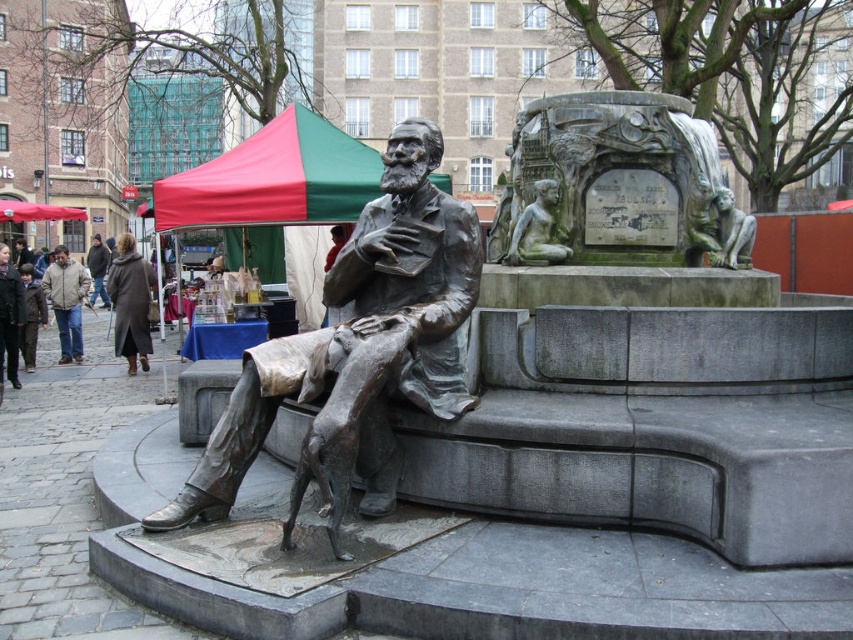
Question: Estimate the real-world distances between objects in this image. Which object is closer to the red fabric canopy at upper center?

Choices:
 (A) bronze statue at center
 (B) green stone statue at upper center
 (C) dark brown leather coat at center
 (D) red fabric canopy at upper left

Answer: (B)

Question: Is brown leather jacket at left thinner than green stone statue at upper center?

Choices:
 (A) yes
 (B) no

Answer: (B)

Question: Is bronze statue at center positioned at the back of green stone statue at upper center?

Choices:
 (A) no
 (B) yes

Answer: (A)

Question: Among these points, which one is nearest to the camera?

Choices:
 (A) (47, 221)
 (B) (74, 292)
 (C) (198, 488)

Answer: (C)

Question: Among these objects, which one is nearest to the camera?

Choices:
 (A) bronze statue at center
 (B) green stone statue at upper center
 (C) red fabric canopy at upper center

Answer: (A)

Question: Can you confirm if brown wool coat at center is wider than red fabric canopy at upper left?

Choices:
 (A) yes
 (B) no

Answer: (B)